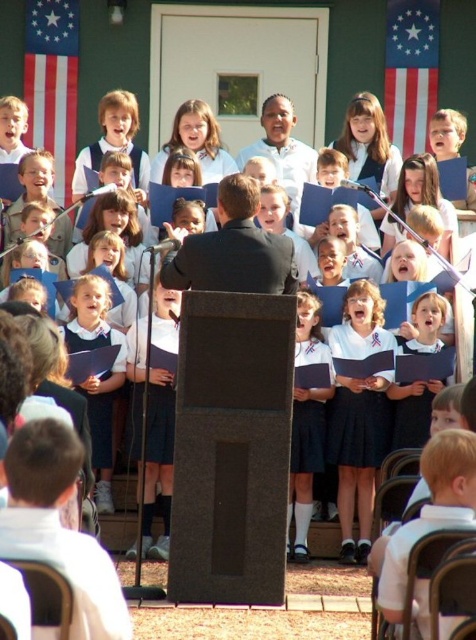
Based on the photo, you are a photographer trying to capture a symmetrical shot of the two flags in the background. Since the american flag at upper left and the red fabric flag at upper right are not the same size, which flag should you adjust your camera angle to focus on to maintain symmetry?

The american flag at upper left is wider than the red fabric flag at upper right. To maintain symmetry, you should focus your camera angle on the red fabric flag at upper right since it is narrower and requires less adjustment.